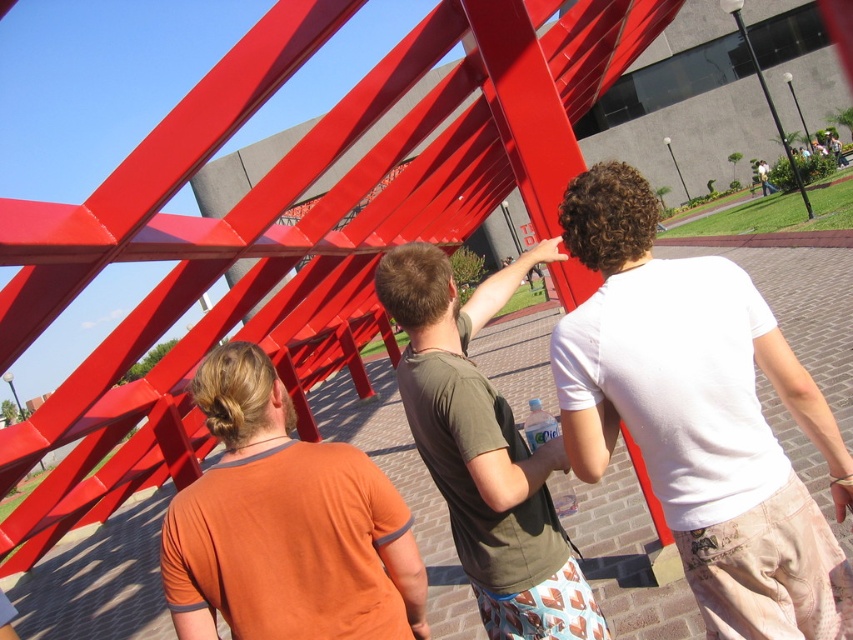
You are standing in front of the red geometric sculpture and want to touch both points on the sculpture. Which point should you reach for first, point 1 at coordinate (651, 404) or point 2 at coordinate (366, 502)?

You should reach for point 1 at coordinate (651, 404) first because it is closer to you than point 2 at coordinate (366, 502).

You are standing in front of the red sculpture and see the orange cotton shirt at center and the white cotton shirt at upper center. Which person is standing closer to you?

The orange cotton shirt at center is closer to the viewer than the white cotton shirt at upper center, so the person wearing the orange cotton shirt at center is closer to you.